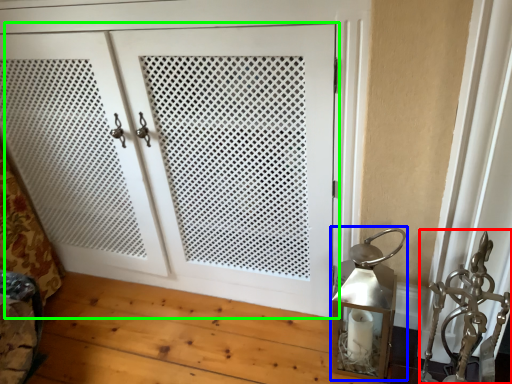
Question: Which object is the closest to the sculpture (highlighted by a red box)? Choose among these: table lamp (highlighted by a blue box) or door (highlighted by a green box).

Choices:
 (A) table lamp
 (B) door

Answer: (A)